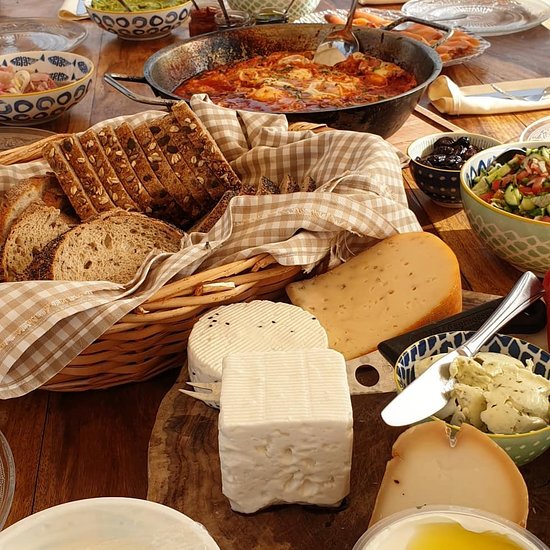
Find the location of a particular element. bowl is located at coordinates (525, 447), (486, 216), (447, 187), (370, 117), (35, 102), (145, 18).